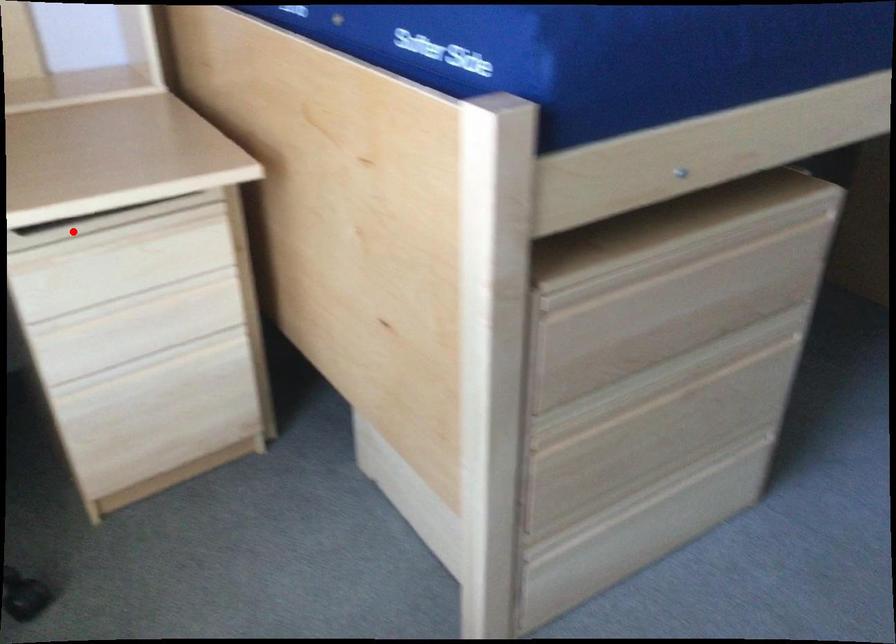
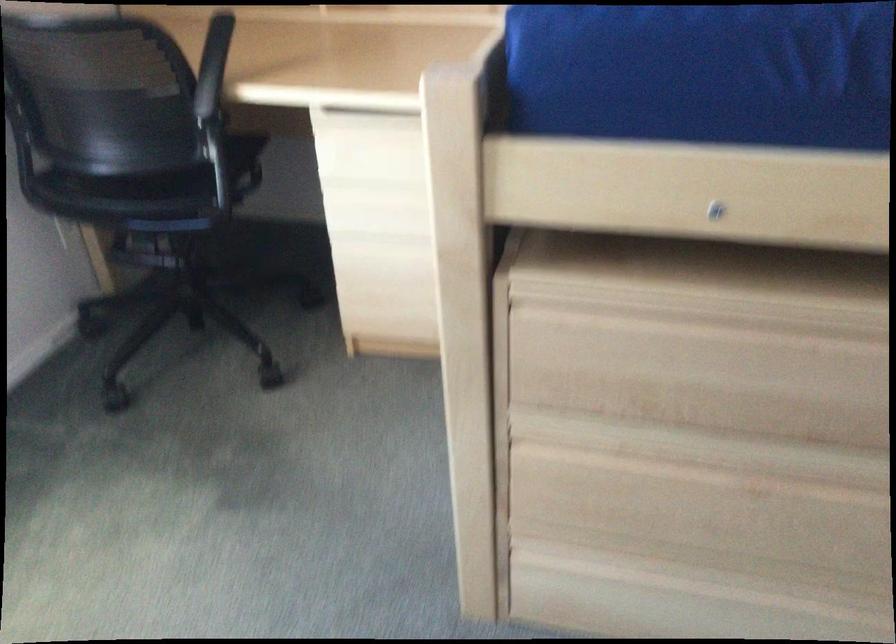
Find the pixel in the second image that matches the highlighted location in the first image.

(364, 117)